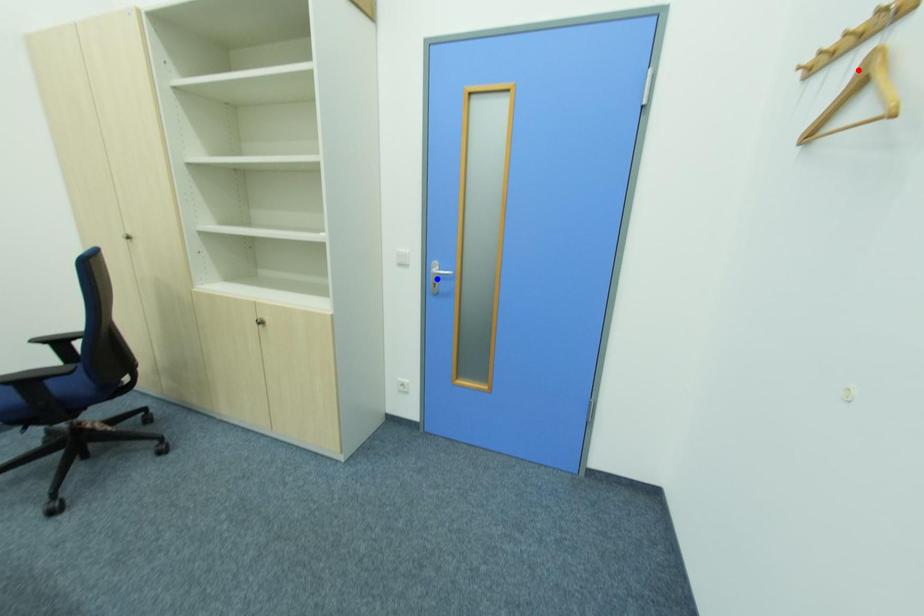
Question: Two points are marked on the image. Which point is closer to the camera?

Choices:
 (A) Blue point is closer.
 (B) Red point is closer.

Answer: (B)